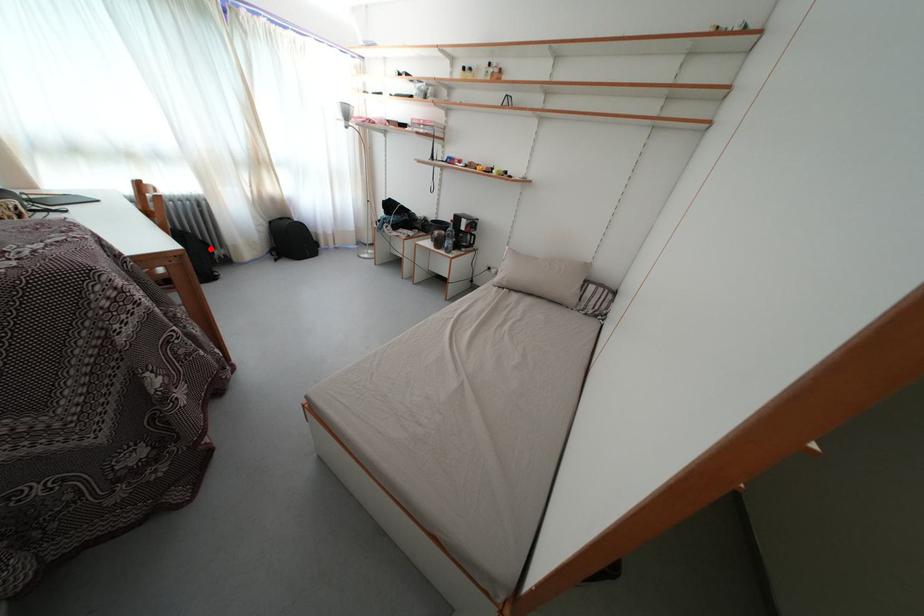
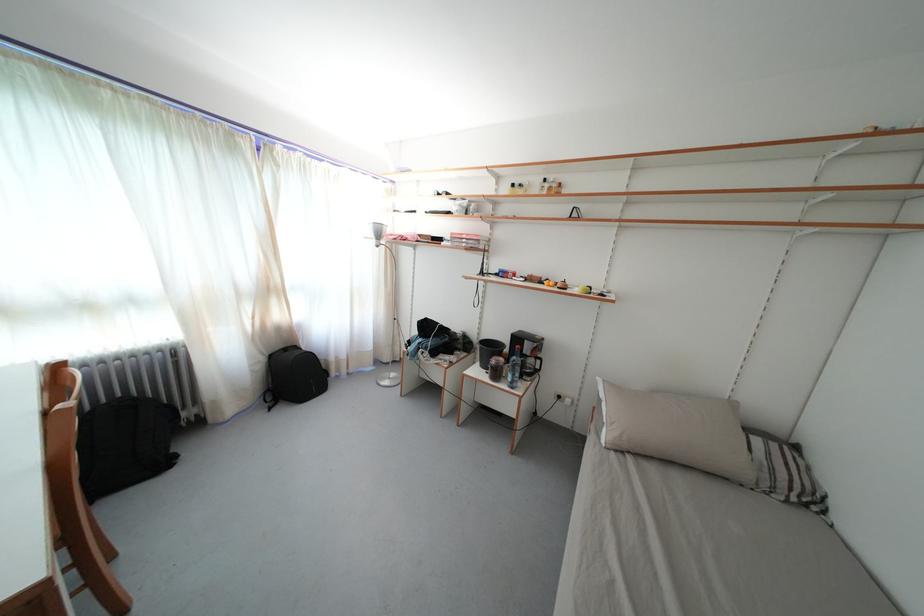
In the second image, find the point that corresponds to the highlighted location in the first image.

(175, 411)